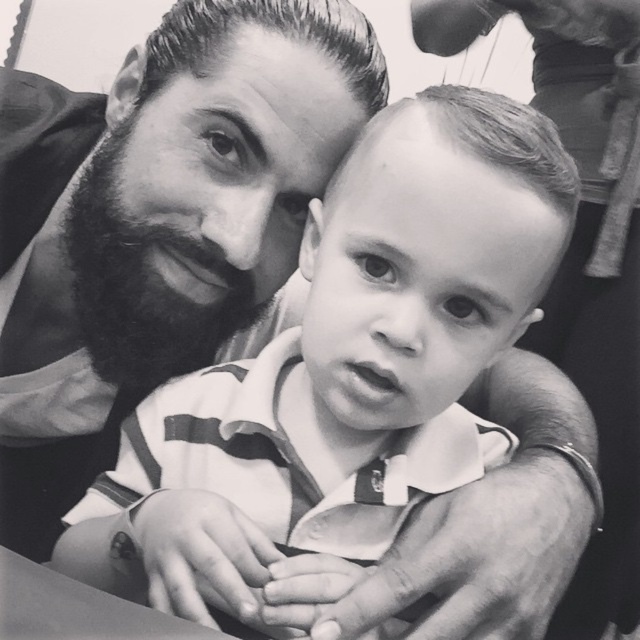
Question: Which of the following is the farthest from the observer?

Choices:
 (A) (310, 314)
 (B) (224, 273)

Answer: (B)

Question: Does white striped shirt at center have a larger size compared to beardsoft/blackbeard at left?

Choices:
 (A) no
 (B) yes

Answer: (B)

Question: Which of these objects is positioned farthest from the matte black shirt at center?

Choices:
 (A) smooth hair at center
 (B) white striped shirt at center
 (C) beardsoft/blackbeard at left

Answer: (A)

Question: Considering the real-world distances, which object is farthest from the smooth hair at center?

Choices:
 (A) white striped shirt at center
 (B) beardsoft/blackbeard at left

Answer: (B)

Question: Is white striped shirt at center to the left of beardsoft/blackbeard at left from the viewer's perspective?

Choices:
 (A) yes
 (B) no

Answer: (B)

Question: In this image, where is white striped shirt at center located relative to smooth hair at center?

Choices:
 (A) right
 (B) left

Answer: (B)